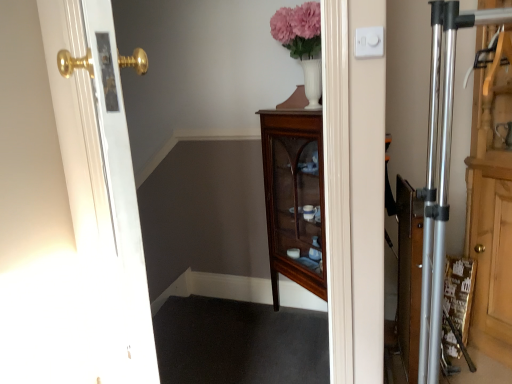
Question: Does white plastic/light switch at upper right have a smaller size compared to mahogany glass-front cabinet at center?

Choices:
 (A) no
 (B) yes

Answer: (B)

Question: Considering the relative positions of white plastic/light switch at upper right and mahogany glass-front cabinet at center in the image provided, is white plastic/light switch at upper right in front of mahogany glass-front cabinet at center?

Choices:
 (A) yes
 (B) no

Answer: (A)

Question: From the image's perspective, would you say white plastic/light switch at upper right is positioned over mahogany glass-front cabinet at center?

Choices:
 (A) yes
 (B) no

Answer: (A)

Question: Is white plastic/light switch at upper right positioned beyond the bounds of mahogany glass-front cabinet at center?

Choices:
 (A) no
 (B) yes

Answer: (B)

Question: From a real-world perspective, is white plastic/light switch at upper right on top of mahogany glass-front cabinet at center?

Choices:
 (A) no
 (B) yes

Answer: (B)

Question: Is mahogany glass-front cabinet at center surrounded by white plastic/light switch at upper right?

Choices:
 (A) no
 (B) yes

Answer: (A)

Question: Could mahogany glass-front cabinet at center be considered to be inside white glossy door at left?

Choices:
 (A) yes
 (B) no

Answer: (B)

Question: Are white glossy door at left and mahogany glass-front cabinet at center located far from each other?

Choices:
 (A) no
 (B) yes

Answer: (B)

Question: From a real-world perspective, does white glossy door at left stand above mahogany glass-front cabinet at center?

Choices:
 (A) yes
 (B) no

Answer: (A)

Question: Are white glossy door at left and mahogany glass-front cabinet at center beside each other?

Choices:
 (A) yes
 (B) no

Answer: (B)

Question: From the image's perspective, is white glossy door at left under mahogany glass-front cabinet at center?

Choices:
 (A) no
 (B) yes

Answer: (A)

Question: Is mahogany glass-front cabinet at center at the back of white glossy door at left?

Choices:
 (A) yes
 (B) no

Answer: (B)

Question: Can you confirm if mahogany glass-front cabinet at center is thinner than white glossy door at left?

Choices:
 (A) no
 (B) yes

Answer: (A)